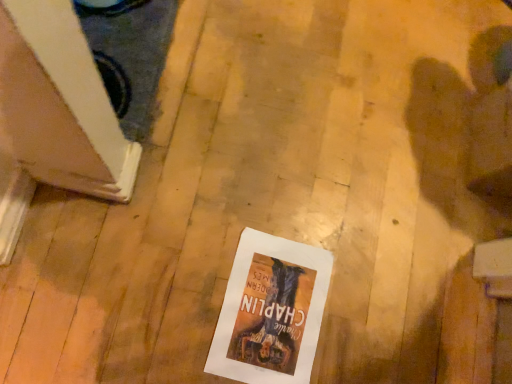
This screenshot has height=384, width=512. What are the coordinates of `vacant space to the right of white paper poster at center` in the screenshot? It's located at [x=376, y=331].